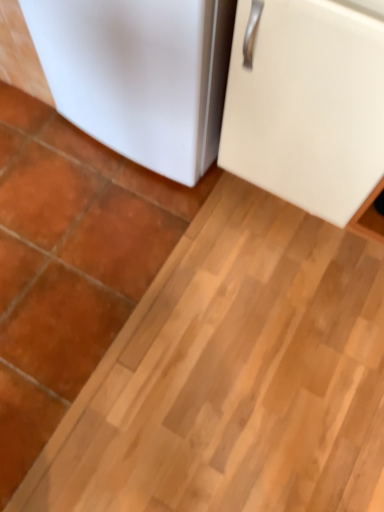
Question: Does white matte refrigerator at lower left, positioned as the 2th refrigerator in right-to-left order, lie behind white matte cabinet at upper right, marked as the 1th refrigerator in a right-to-left arrangement?

Choices:
 (A) yes
 (B) no

Answer: (A)

Question: Considering the relative sizes of white matte refrigerator at lower left, the 1th refrigerator from the left, and white matte cabinet at upper right, which appears as the 2th refrigerator when viewed from the left, in the image provided, is white matte refrigerator at lower left, the 1th refrigerator from the left, taller than white matte cabinet at upper right, which appears as the 2th refrigerator when viewed from the left,?

Choices:
 (A) yes
 (B) no

Answer: (B)

Question: From the image's perspective, does white matte refrigerator at lower left, the 1th refrigerator from the left, appear lower than white matte cabinet at upper right, marked as the 1th refrigerator in a right-to-left arrangement?

Choices:
 (A) yes
 (B) no

Answer: (B)

Question: Can white matte cabinet at upper right, which appears as the 2th refrigerator when viewed from the left, be found inside white matte refrigerator at lower left, positioned as the 2th refrigerator in right-to-left order?

Choices:
 (A) no
 (B) yes

Answer: (A)

Question: Does white matte refrigerator at lower left, positioned as the 2th refrigerator in right-to-left order, come in front of white matte cabinet at upper right, which appears as the 2th refrigerator when viewed from the left?

Choices:
 (A) no
 (B) yes

Answer: (A)

Question: Is the surface of white matte refrigerator at lower left, the 1th refrigerator from the left, in direct contact with white matte cabinet at upper right, marked as the 1th refrigerator in a right-to-left arrangement?

Choices:
 (A) yes
 (B) no

Answer: (B)

Question: Is white matte cabinet at upper right, marked as the 1th refrigerator in a right-to-left arrangement, to the left of white matte refrigerator at lower left, the 1th refrigerator from the left, from the viewer's perspective?

Choices:
 (A) yes
 (B) no

Answer: (B)

Question: From a real-world perspective, is white matte cabinet at upper right, marked as the 1th refrigerator in a right-to-left arrangement, on white matte refrigerator at lower left, the 1th refrigerator from the left?

Choices:
 (A) yes
 (B) no

Answer: (A)

Question: Could you tell me if white matte cabinet at upper right, marked as the 1th refrigerator in a right-to-left arrangement, is facing white matte refrigerator at lower left, the 1th refrigerator from the left?

Choices:
 (A) yes
 (B) no

Answer: (B)

Question: Considering the relative sizes of white matte cabinet at upper right, marked as the 1th refrigerator in a right-to-left arrangement, and white matte refrigerator at lower left, positioned as the 2th refrigerator in right-to-left order, in the image provided, is white matte cabinet at upper right, marked as the 1th refrigerator in a right-to-left arrangement, smaller than white matte refrigerator at lower left, positioned as the 2th refrigerator in right-to-left order,?

Choices:
 (A) yes
 (B) no

Answer: (B)

Question: Is white matte cabinet at upper right, marked as the 1th refrigerator in a right-to-left arrangement, not inside white matte refrigerator at lower left, positioned as the 2th refrigerator in right-to-left order?

Choices:
 (A) yes
 (B) no

Answer: (A)

Question: Considering the positions of white matte cabinet at upper right, which appears as the 2th refrigerator when viewed from the left, and white matte refrigerator at lower left, positioned as the 2th refrigerator in right-to-left order, in the image, is white matte cabinet at upper right, which appears as the 2th refrigerator when viewed from the left, taller or shorter than white matte refrigerator at lower left, positioned as the 2th refrigerator in right-to-left order,?

Choices:
 (A) short
 (B) tall

Answer: (B)